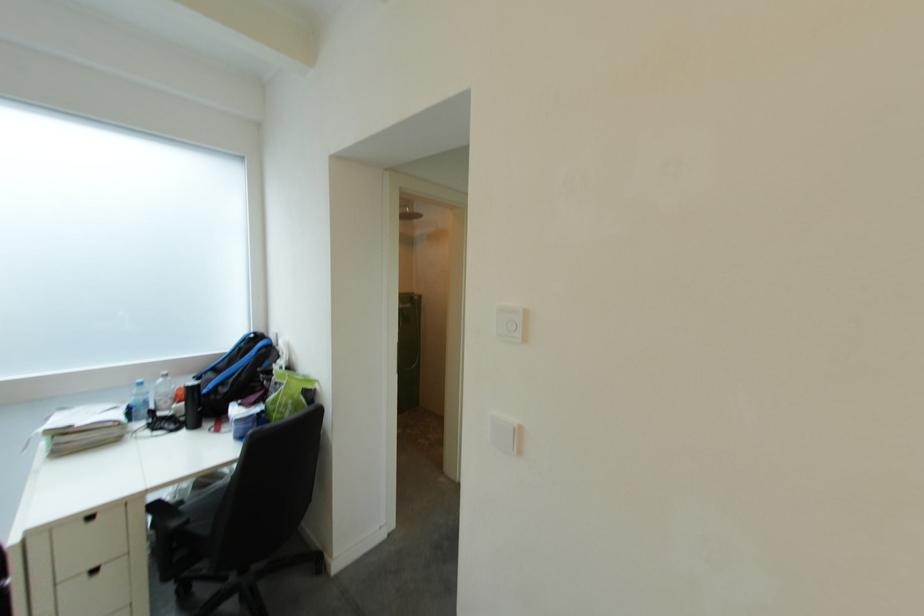
This screenshot has height=616, width=924. Describe the element at coordinates (511, 323) in the screenshot. I see `a white wall control` at that location.